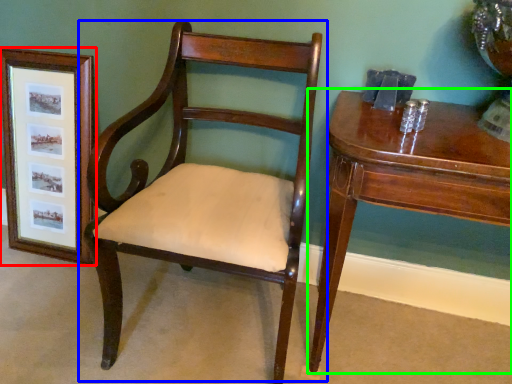
Question: Estimate the real-world distances between objects in this image. Which object is farther from picture frame (highlighted by a red box), chair (highlighted by a blue box) or table (highlighted by a green box)?

Choices:
 (A) chair
 (B) table

Answer: (B)